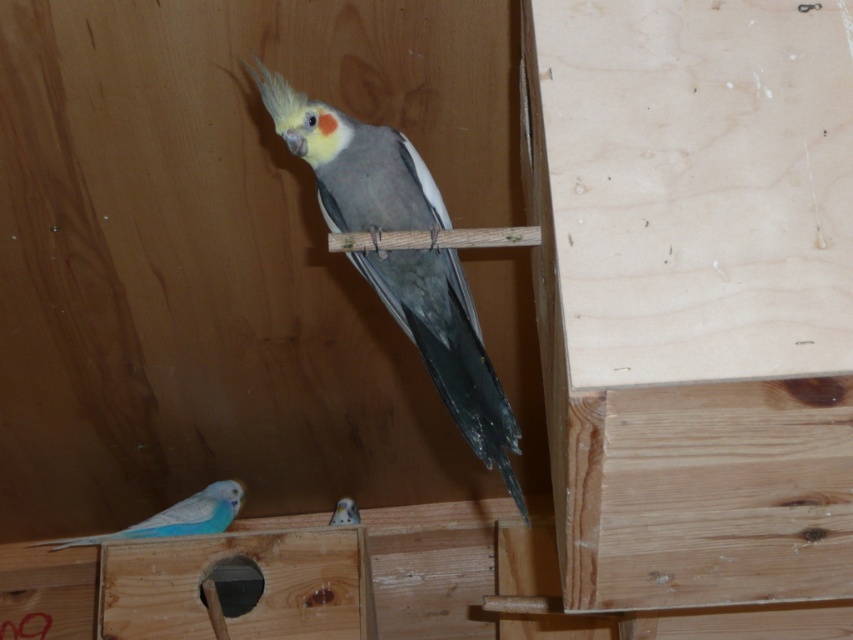
From the picture: You are a bird enthusiast observing the wooden enclosure. You notice the gray matte parrot at center and the blue glossy parakeet at lower left. Which bird is closer to you?

The gray matte parrot at center is closer to you because it is in front of the blue glossy parakeet at lower left.

You are a bird enthusiast observing the wooden enclosure. You notice a gray matte parrot at center and a matte blue parrot at lower left. Which parrot has a greater width?

The gray matte parrot at center has a greater width than the matte blue parrot at lower left.

You are observing the wooden enclosure with birds. The gray matte parrot at center and the blue glossy parakeet at lower left are both visible. Which bird is positioned higher in the enclosure?

The gray matte parrot at center is positioned higher in the enclosure than the blue glossy parakeet at lower left.